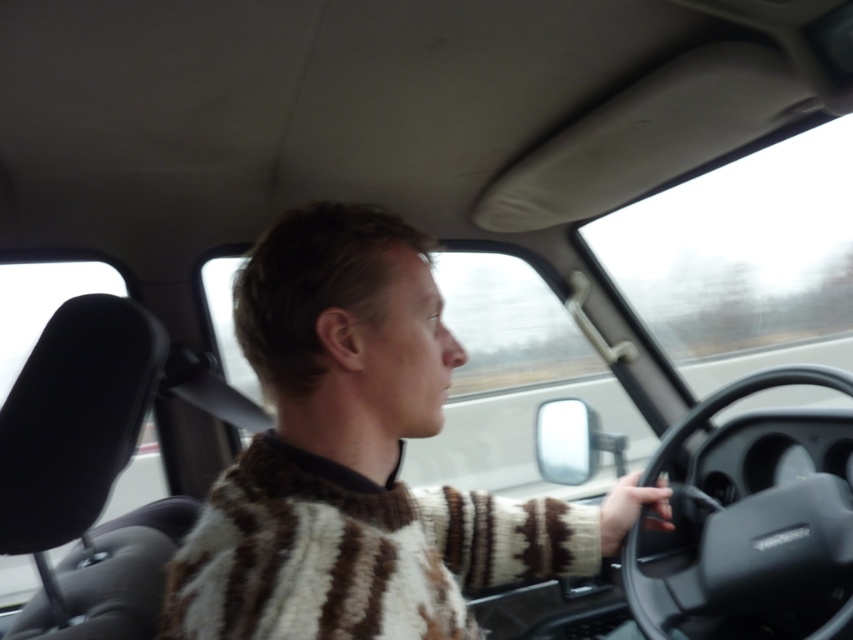
You are a passenger in the car and want to hand the driver a map. The map is on the passenger seat. To reach the driver, you need to pass the map over the black matte steering wheel at center. Is the striped wool sweater at center in your way?

The striped wool sweater at center is to the left of the black matte steering wheel at center, so it is positioned away from the path between the passenger seat and the driver. Therefore, the striped wool sweater at center is not in your way.